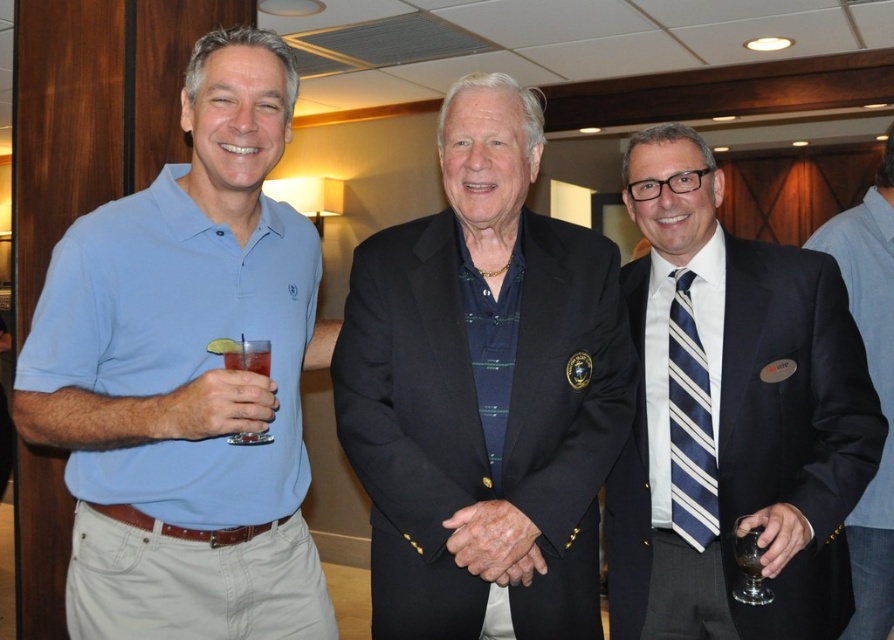
Question: Which object is positioned closest to the blue cotton polo shirt at center?

Choices:
 (A) matte plastic cup at left
 (B) blue striped tie at center
 (C) black textured blazer at center

Answer: (B)

Question: Is striped tie at center above translucent glass at left?

Choices:
 (A) yes
 (B) no

Answer: (A)

Question: Which of these objects is positioned closest to the matte plastic cup at left?

Choices:
 (A) striped tie at center
 (B) black textured blazer at center
 (C) translucent glass at lower right

Answer: (B)

Question: Among these objects, which one is nearest to the camera?

Choices:
 (A) matte blue polo shirt at left
 (B) blue striped tie at center
 (C) striped tie at center

Answer: (A)

Question: Observing the image, what is the correct spatial positioning of matte blue polo shirt at left in reference to striped tie at center?

Choices:
 (A) left
 (B) right

Answer: (A)

Question: Is black textured blazer at center thinner than translucent glass at left?

Choices:
 (A) no
 (B) yes

Answer: (A)